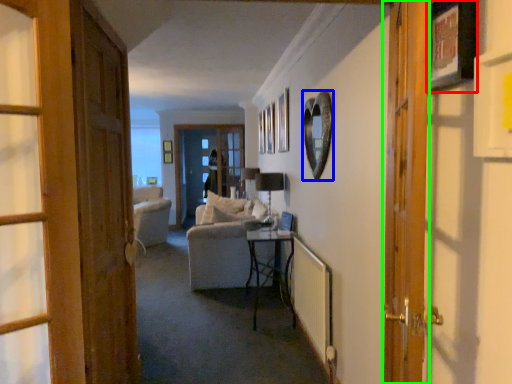
Question: Considering the real-world distances, which object is farthest from picture frame (highlighted by a red box)? picture frame (highlighted by a blue box) or door (highlighted by a green box)?

Choices:
 (A) picture frame
 (B) door

Answer: (A)